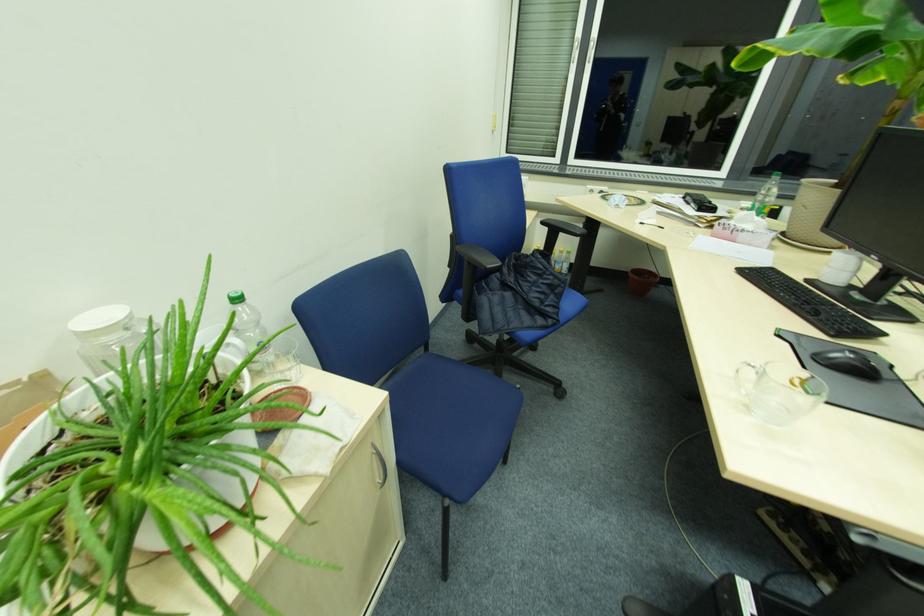
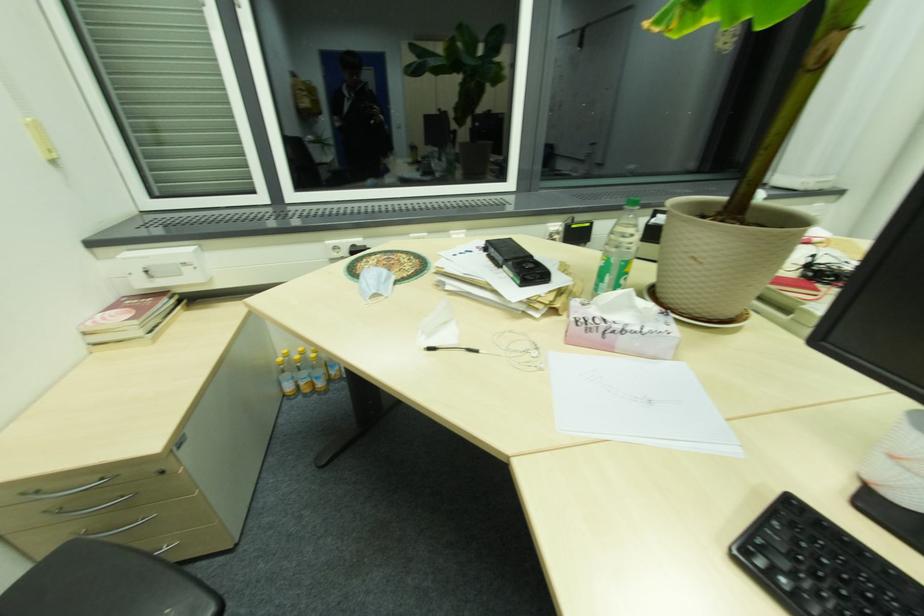
Locate, in the second image, the point that corresponds to pixel 719 237 in the first image.

(575, 342)